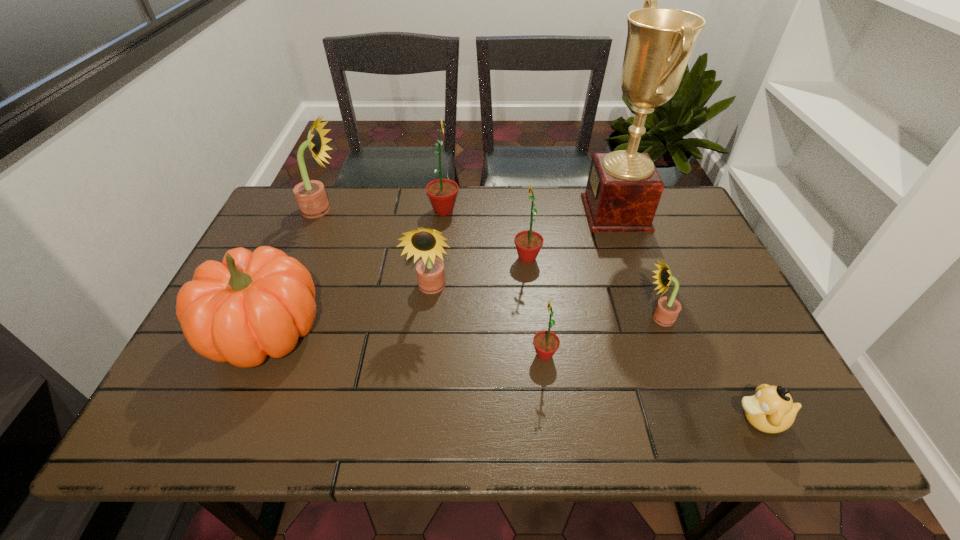
Identify the location of trophy cup. Image resolution: width=960 pixels, height=540 pixels. (x=623, y=190).

Where is `the leftmost sunflower`? This screenshot has height=540, width=960. the leftmost sunflower is located at coordinates (310, 195).

Where is `the biggest yellow sunflower`? This screenshot has height=540, width=960. the biggest yellow sunflower is located at coordinates (310, 195).

Where is `the biggest green sunflower`? The height and width of the screenshot is (540, 960). the biggest green sunflower is located at coordinates (442, 193).

Locate an element on the screen. This screenshot has width=960, height=540. the farthest green sunflower is located at coordinates (442, 193).

This screenshot has width=960, height=540. Find the location of `orange pumpkin`. orange pumpkin is located at coordinates (251, 305).

At what (x,y) coordinates should I click in order to perform the action: click on the second biggest green sunflower. Please return your answer as a coordinate pair (x, y). The image size is (960, 540). Looking at the image, I should click on (528, 243).

At what (x,y) coordinates should I click in order to perform the action: click on the fourth nearest sunflower. Please return your answer as a coordinate pair (x, y). The width and height of the screenshot is (960, 540). Looking at the image, I should click on (528, 243).

Locate an element on the screen. The width and height of the screenshot is (960, 540). the third nearest sunflower is located at coordinates (427, 243).

Identify the location of the second farthest yellow sunflower. This screenshot has height=540, width=960. (427, 243).